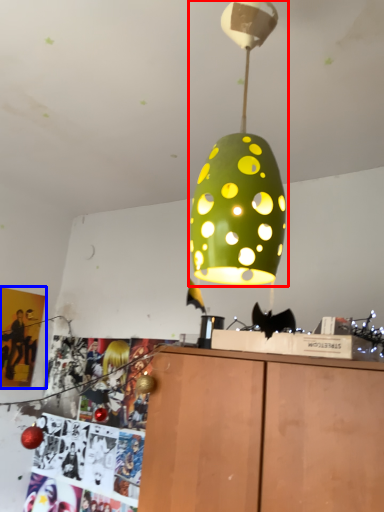
Question: Which of the following is the closest to the observer, lamp (highlighted by a red box) or poster page (highlighted by a blue box)?

Choices:
 (A) lamp
 (B) poster page

Answer: (A)